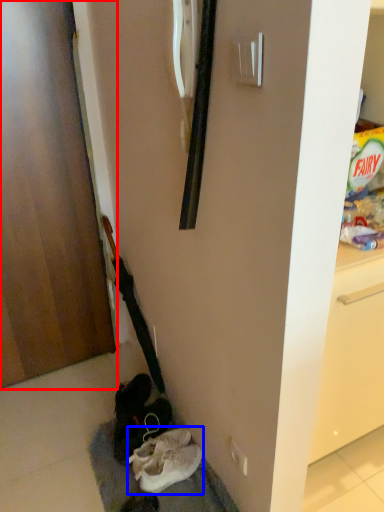
Question: Which point is closer to the camera, door (highlighted by a red box) or footwear (highlighted by a blue box)?

Choices:
 (A) door
 (B) footwear

Answer: (A)